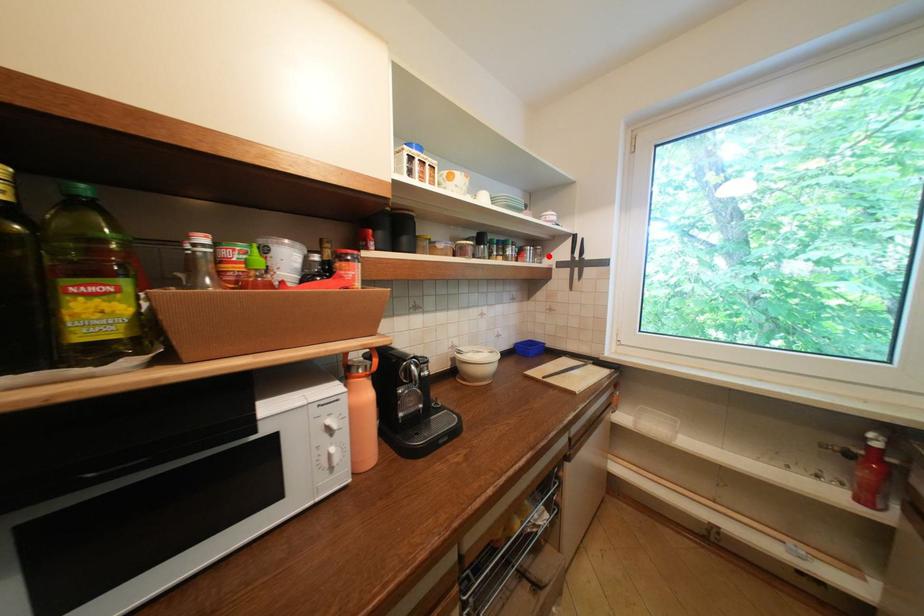
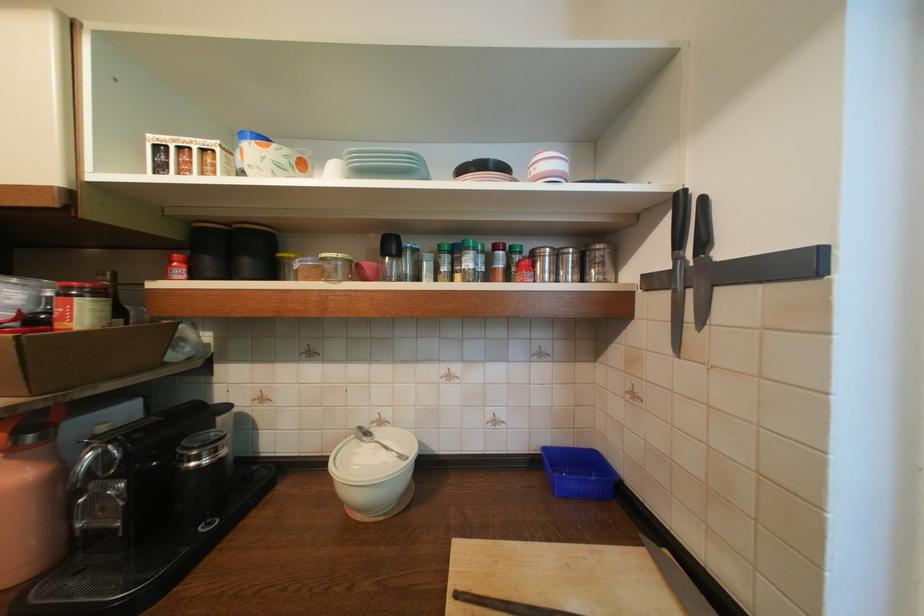
The point at the highlighted location is marked in the first image. Where is the corresponding point in the second image?

(611, 265)